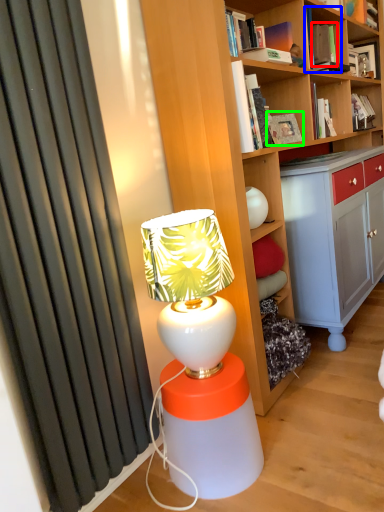
Question: Considering the real-world distances, which object is farthest from book (highlighted by a red box)? book (highlighted by a blue box) or book (highlighted by a green box)?

Choices:
 (A) book
 (B) book

Answer: (B)